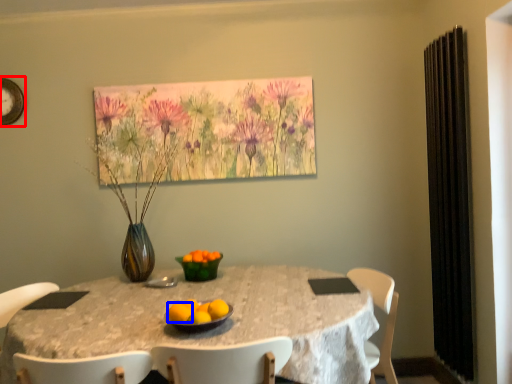
Question: Which of the following is the closest to the observer, clock (highlighted by a red box) or orange (highlighted by a blue box)?

Choices:
 (A) clock
 (B) orange

Answer: (B)